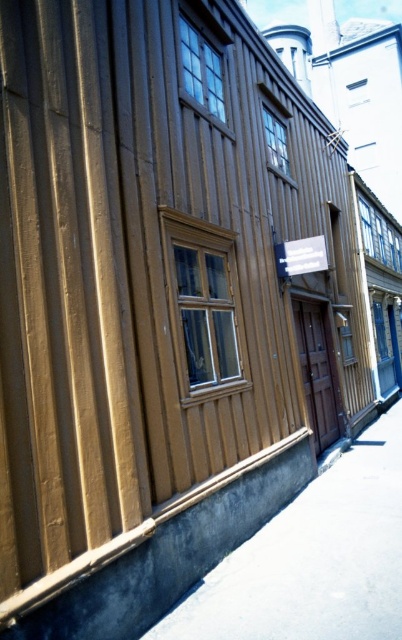
Who is more forward, (x=332, y=500) or (x=280, y=170)?

Positioned in front is point (x=332, y=500).

Is gray concrete pavement at lower center thinner than clear glass window at center?

No, gray concrete pavement at lower center is not thinner than clear glass window at center.

This screenshot has height=640, width=402. Find the location of `gray concrete pavement at lower center`. gray concrete pavement at lower center is located at coordinates (313, 557).

Who is higher up, clear glass window at upper center or clear glass window at upper right?

Positioned higher is clear glass window at upper right.

Does clear glass window at upper center have a greater width compared to clear glass window at upper right?

Correct, the width of clear glass window at upper center exceeds that of clear glass window at upper right.

Which is in front, point (205, 61) or point (389, 228)?

Point (205, 61) is in front.

You are a GUI agent. You are given a task and a screenshot of the screen. Output one action in this format:
    pyautogui.click(x=<x>, y=<y>)
    Task: Click on the clear glass window at upper center
    The width and height of the screenshot is (402, 640).
    Given the screenshot: What is the action you would take?
    pyautogui.click(x=201, y=68)

Does gray concrete pavement at lower center have a smaller size compared to wooden window at center?

Yes.

Consider the image. Who is higher up, gray concrete pavement at lower center or wooden window at center?

wooden window at center is above.

Image resolution: width=402 pixels, height=640 pixels. I want to click on gray concrete pavement at lower center, so click(313, 557).

At what (x,y) coordinates should I click in order to perform the action: click on gray concrete pavement at lower center. Please return your answer as a coordinate pair (x, y). The image size is (402, 640). Looking at the image, I should click on (313, 557).